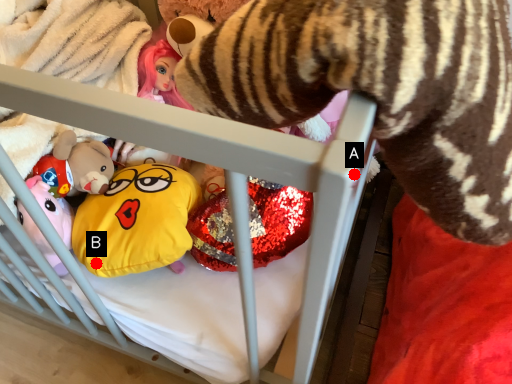
Question: Two points are circled on the image, labeled by A and B beside each circle. Which of the following is the farthest from the observer?

Choices:
 (A) A is further
 (B) B is further

Answer: (B)